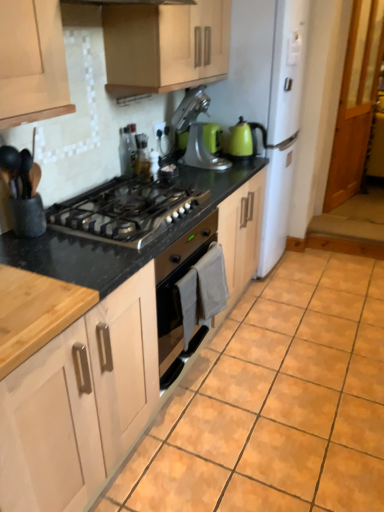
Question: Is translucent glass bottle at upper center, which is counted as the 3th appliance, starting from the back, shorter than stainless steel gas stove at center?

Choices:
 (A) no
 (B) yes

Answer: (A)

Question: Is translucent glass bottle at upper center, the 1th appliance when ordered from front to back, touching stainless steel gas stove at center?

Choices:
 (A) yes
 (B) no

Answer: (B)

Question: Is translucent glass bottle at upper center, which is counted as the 3th appliance, starting from the back, to the right of stainless steel gas stove at center from the viewer's perspective?

Choices:
 (A) no
 (B) yes

Answer: (B)

Question: From a real-world perspective, is translucent glass bottle at upper center, which is counted as the 3th appliance, starting from the back, positioned under stainless steel gas stove at center based on gravity?

Choices:
 (A) yes
 (B) no

Answer: (B)

Question: Is translucent glass bottle at upper center, which is counted as the 3th appliance, starting from the back, wider than stainless steel gas stove at center?

Choices:
 (A) no
 (B) yes

Answer: (A)

Question: In terms of size, does translucent glass bottle at upper center, the second appliance positioned from the right, appear bigger or smaller than matte wood cabinet at upper center, the second cabinetry in the bottom-to-top sequence?

Choices:
 (A) big
 (B) small

Answer: (B)

Question: Relative to matte wood cabinet at upper center, placed as the 1th cabinetry when sorted from top to bottom, is translucent glass bottle at upper center, the 1th appliance when ordered from front to back, in front or behind?

Choices:
 (A) behind
 (B) front

Answer: (A)

Question: Would you say translucent glass bottle at upper center, which is counted as the 3th appliance, starting from the back, is to the left or to the right of matte wood cabinet at upper center, the second cabinetry in the bottom-to-top sequence, in the picture?

Choices:
 (A) left
 (B) right

Answer: (A)

Question: Which is correct: translucent glass bottle at upper center, the 1th appliance when ordered from front to back, is inside matte wood cabinet at upper center, the second cabinetry in the bottom-to-top sequence, or outside of it?

Choices:
 (A) outside
 (B) inside

Answer: (A)

Question: Looking at their shapes, would you say natural wood cabinet doors at lower left, which appears as the first cabinetry when ordered from the bottom, is wider or thinner than orange matte tile at center?

Choices:
 (A) thin
 (B) wide

Answer: (A)

Question: Based on their sizes in the image, would you say natural wood cabinet doors at lower left, which appears as the first cabinetry when ordered from the bottom, is bigger or smaller than orange matte tile at center?

Choices:
 (A) small
 (B) big

Answer: (B)

Question: From their relative heights in the image, would you say natural wood cabinet doors at lower left, which appears as the first cabinetry when ordered from the bottom, is taller or shorter than orange matte tile at center?

Choices:
 (A) short
 (B) tall

Answer: (B)

Question: Choose the correct answer: Is natural wood cabinet doors at lower left, which appears as the first cabinetry when ordered from the bottom, inside orange matte tile at center or outside it?

Choices:
 (A) outside
 (B) inside

Answer: (A)

Question: Is satin silver toaster at upper center, the 2th appliance from the back, wider or thinner than stainless steel gas stove at center?

Choices:
 (A) wide
 (B) thin

Answer: (B)

Question: From their relative heights in the image, would you say satin silver toaster at upper center, the third appliance viewed from the right, is taller or shorter than stainless steel gas stove at center?

Choices:
 (A) short
 (B) tall

Answer: (B)